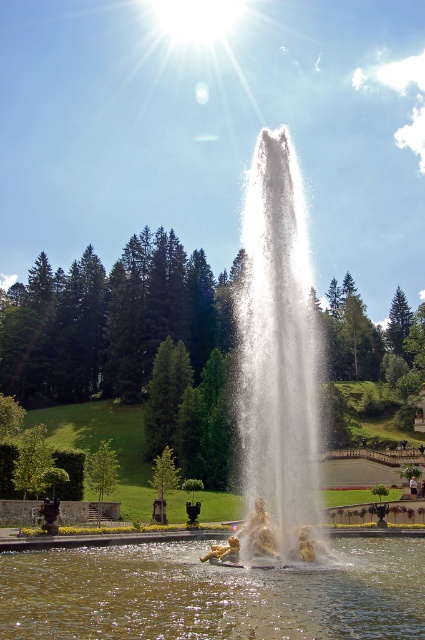
Question: Can you confirm if clear water at fountain center is thinner than white water at center?

Choices:
 (A) no
 (B) yes

Answer: (B)

Question: Which point is farther to the camera?

Choices:
 (A) clear water at fountain center
 (B) white water at center

Answer: (B)

Question: Does clear water at fountain center have a larger size compared to white water at center?

Choices:
 (A) yes
 (B) no

Answer: (B)

Question: Does clear water at fountain center come behind white water at center?

Choices:
 (A) no
 (B) yes

Answer: (A)